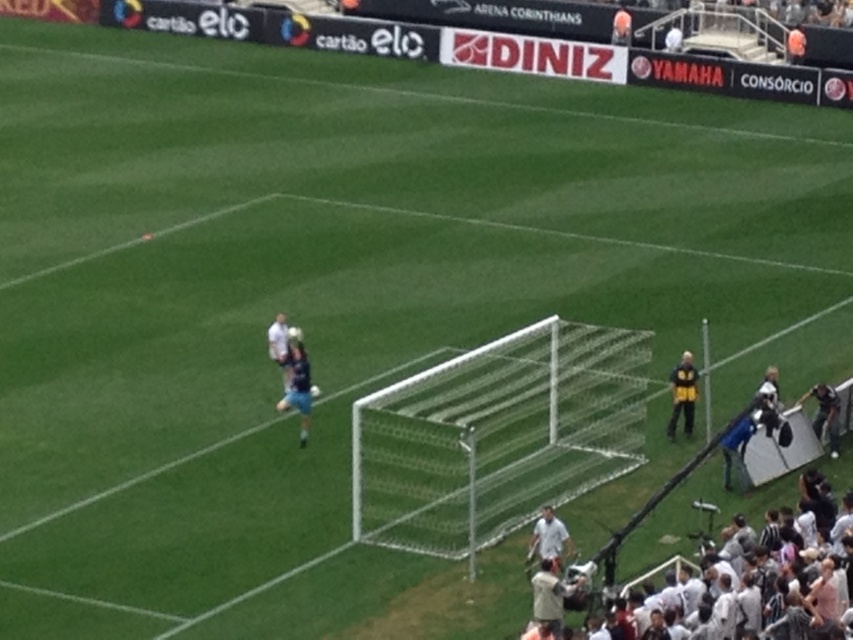
Question: Observing the image, what is the correct spatial positioning of yellow jacket at right in reference to white matte shirt at lower center?

Choices:
 (A) left
 (B) right

Answer: (B)

Question: Which of these objects is positioned closest to the blue jersey at center?

Choices:
 (A) yellow jacket at right
 (B) white mesh net at center
 (C) white matte shirt at lower center

Answer: (B)

Question: Among these points, which one is farthest from the camera?

Choices:
 (A) (824, 394)
 (B) (289, 404)
 (C) (689, 394)
 (D) (561, 548)

Answer: (C)

Question: Can you confirm if white mesh net at center is positioned to the left of dark blue jersey at right?

Choices:
 (A) yes
 (B) no

Answer: (A)

Question: Is white mesh net at center wider than dark blue jersey at right?

Choices:
 (A) yes
 (B) no

Answer: (A)

Question: Which object is positioned farthest from the white mesh net at center?

Choices:
 (A) dark blue jersey at right
 (B) yellow jacket at right

Answer: (A)